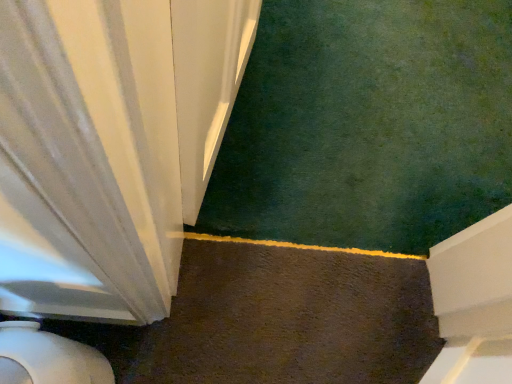
Describe the element at coordinates (48, 358) in the screenshot. I see `white glossy toilet at lower left` at that location.

I want to click on white glossy toilet at lower left, so click(48, 358).

Identify the location of white glossy toilet at lower left. (48, 358).